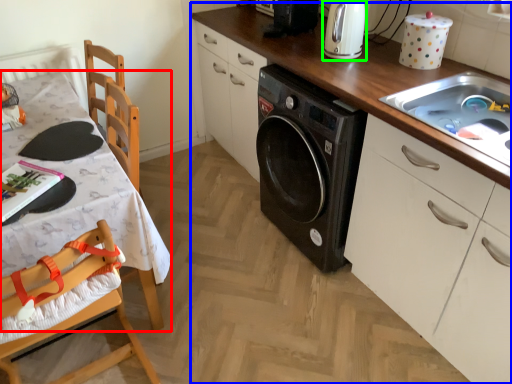
Question: Which object is positioned closest to table (highlighted by a red box)? Select from countertop (highlighted by a blue box) and home appliance (highlighted by a green box).

Choices:
 (A) countertop
 (B) home appliance

Answer: (A)